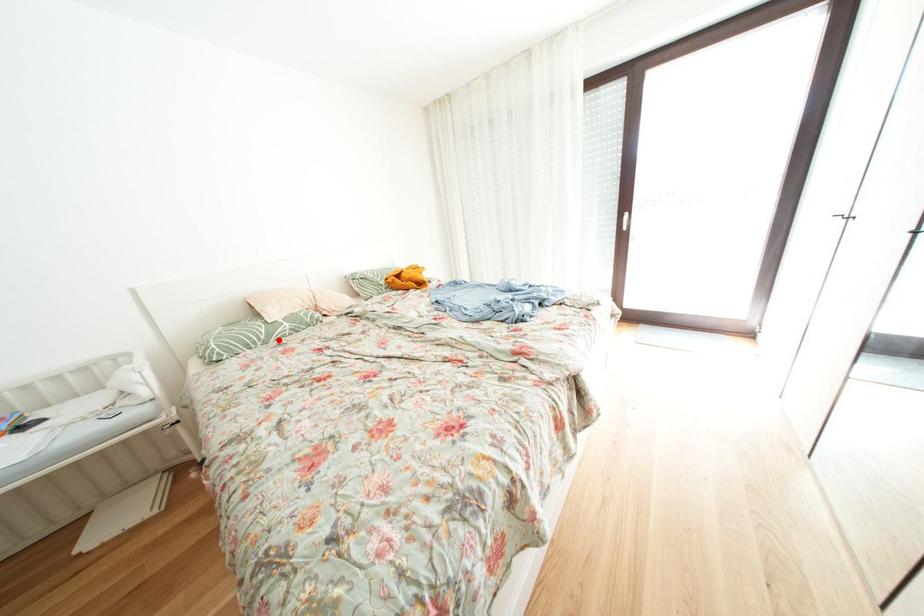
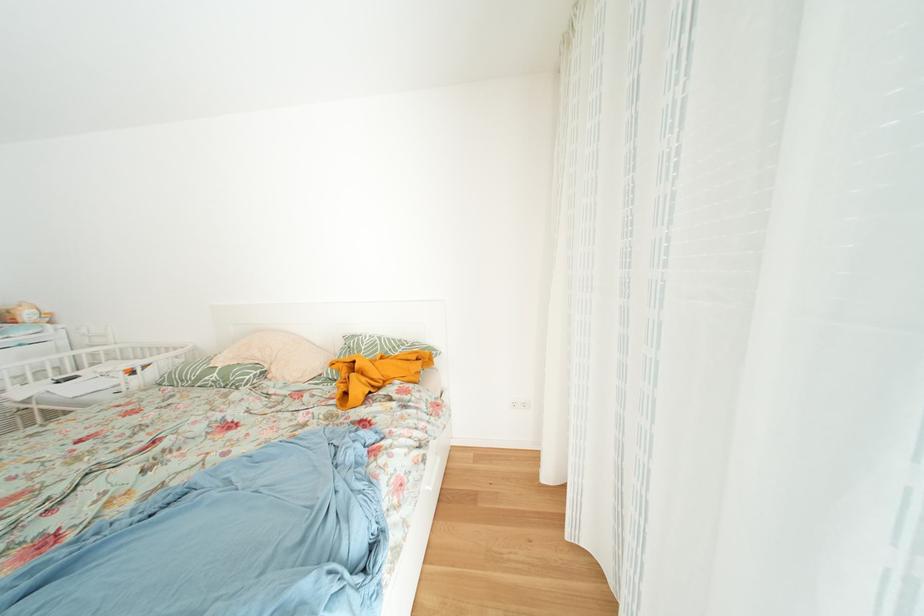
In the second image, find the point that corresponds to the highlighted location in the first image.

(208, 384)